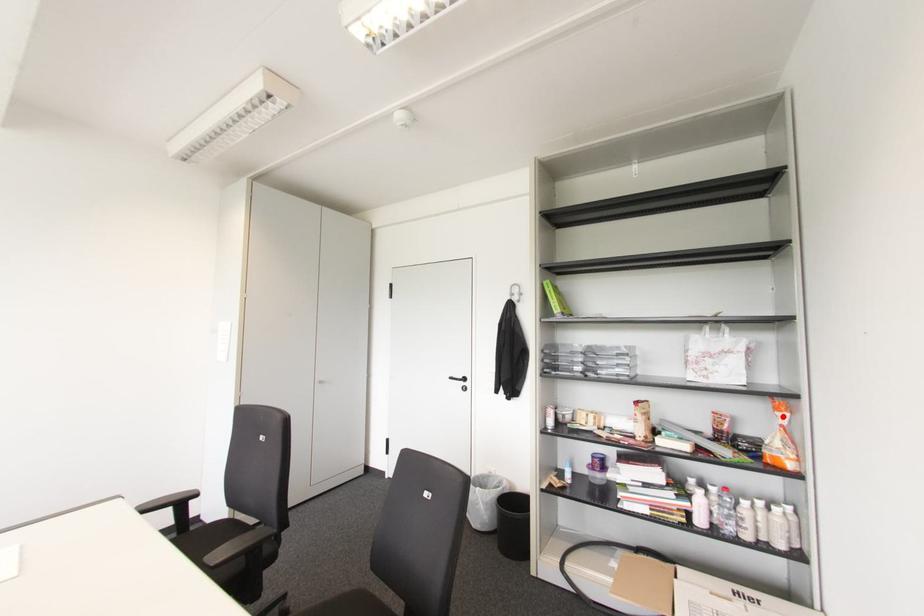
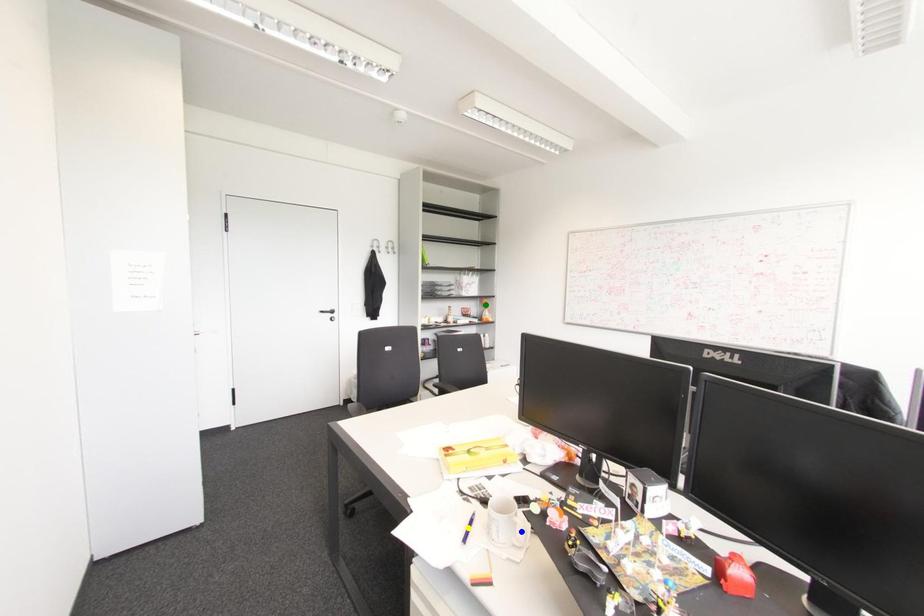
Question: I am providing you with two images of the same scene from different viewpoints. A red point is marked on the first image. You are given multiple points on the second image. Which mark in image 2 goes with the point in image 1?

Choices:
 (A) yellow point
 (B) green point
 (C) blue point

Answer: (B)